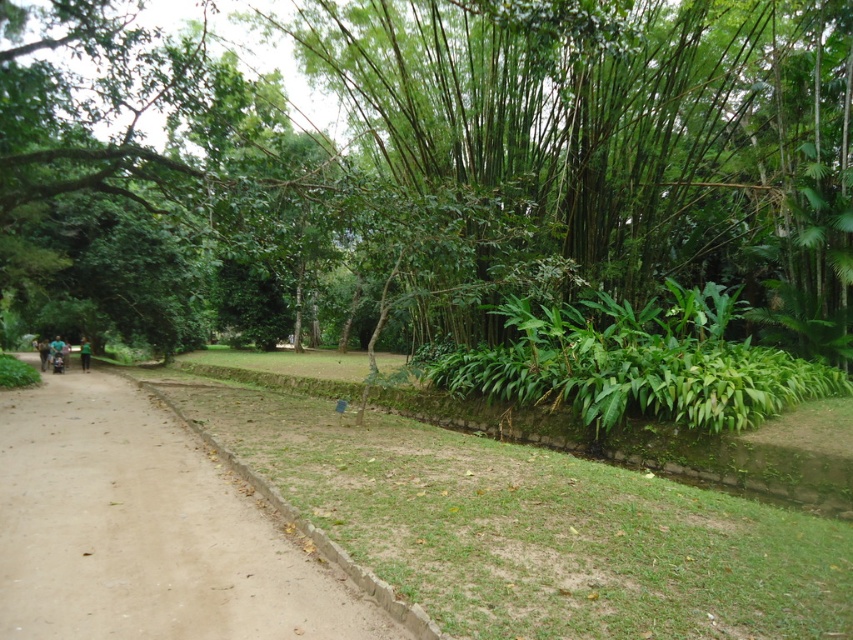
Based on the photo, does green fabric person at center have a greater height compared to green fabric person at left?

Yes.

The image size is (853, 640). I want to click on green fabric person at center, so click(84, 353).

Which of these two, green leafy plants at center or green fabric person at left, stands shorter?

green fabric person at left

Is green leafy plants at center bigger than green fabric person at left?

Correct, green leafy plants at center is larger in size than green fabric person at left.

This screenshot has height=640, width=853. Find the location of `green leafy plants at center`. green leafy plants at center is located at coordinates (636, 364).

Is brown dirt track at center below green fabric person at left?

Yes, brown dirt track at center is below green fabric person at left.

Between brown dirt track at center and green fabric person at left, which one appears on the right side from the viewer's perspective?

Positioned to the right is brown dirt track at center.

Is point (126, 508) closer to viewer compared to point (51, 352)?

Yes, it is in front of point (51, 352).

This screenshot has height=640, width=853. What are the coordinates of `brown dirt track at center` in the screenshot? It's located at (148, 531).